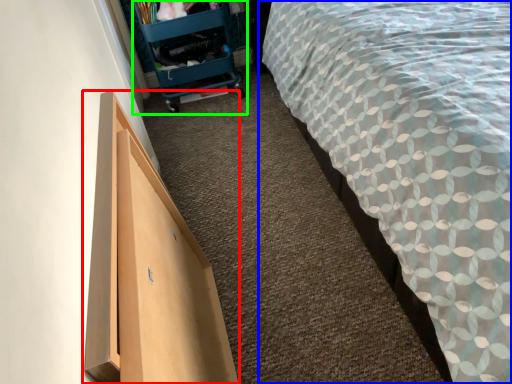
Question: Considering the real-world distances, which object is closest to furniture (highlighted by a red box)? bed (highlighted by a blue box) or trolley (highlighted by a green box).

Choices:
 (A) bed
 (B) trolley

Answer: (A)